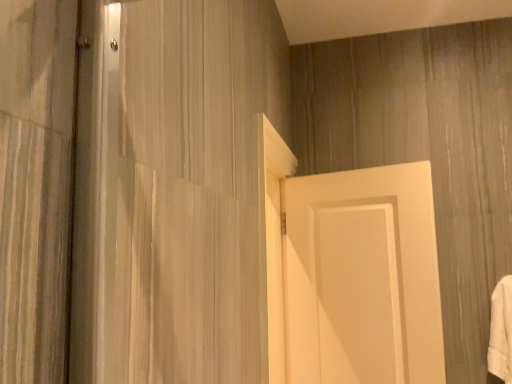
Question: Considering the relative sizes of white soft towel at right and white matte door at center in the image provided, is white soft towel at right smaller than white matte door at center?

Choices:
 (A) no
 (B) yes

Answer: (B)

Question: Can you confirm if white soft towel at right is taller than white matte door at center?

Choices:
 (A) no
 (B) yes

Answer: (A)

Question: Is white soft towel at right behind white matte door at center?

Choices:
 (A) yes
 (B) no

Answer: (A)

Question: Can you see white soft towel at right touching white matte door at center?

Choices:
 (A) yes
 (B) no

Answer: (B)

Question: Is white soft towel at right thinner than white matte door at center?

Choices:
 (A) no
 (B) yes

Answer: (A)

Question: Does white soft towel at right have a lesser height compared to white matte door at center?

Choices:
 (A) no
 (B) yes

Answer: (B)

Question: Can you confirm if white matte door at center is positioned to the right of white soft towel at right?

Choices:
 (A) no
 (B) yes

Answer: (A)

Question: Can you confirm if white matte door at center is positioned to the left of white soft towel at right?

Choices:
 (A) no
 (B) yes

Answer: (B)

Question: Is white soft towel at right at the back of white matte door at center?

Choices:
 (A) no
 (B) yes

Answer: (A)

Question: From the image's perspective, is white matte door at center located beneath white soft towel at right?

Choices:
 (A) no
 (B) yes

Answer: (A)

Question: From a real-world perspective, is white matte door at center positioned under white soft towel at right based on gravity?

Choices:
 (A) yes
 (B) no

Answer: (B)

Question: Does white matte door at center contain white soft towel at right?

Choices:
 (A) no
 (B) yes

Answer: (A)

Question: From a real-world perspective, is white soft towel at right above or below white matte door at center?

Choices:
 (A) below
 (B) above

Answer: (A)